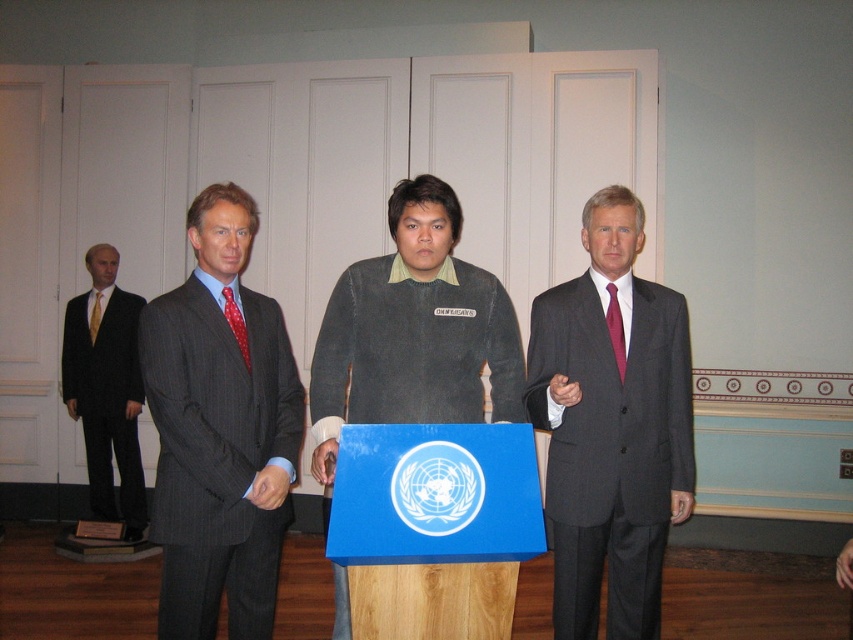
Does dark gray sweater at center appear on the right side of matte black suit at left?

Yes, dark gray sweater at center is to the right of matte black suit at left.

Is dark gray sweater at center further to the viewer compared to matte black suit at left?

No, it is not.

This screenshot has width=853, height=640. What are the coordinates of `dark gray sweater at center` in the screenshot? It's located at (415, 332).

Is point (622, 368) less distant than point (96, 314)?

Yes, point (622, 368) is in front of point (96, 314).

Which is above, maroon silk tie at right or yellow silk tie at left?

yellow silk tie at left is above.

What are the coordinates of `maroon silk tie at right` in the screenshot? It's located at (614, 330).

Is gray pinstripe suit at center below yellow silk tie at left?

Yes.

Which is behind, point (288, 483) or point (90, 308)?

Positioned behind is point (90, 308).

In order to click on gray pinstripe suit at center in this screenshot , I will do `click(219, 432)`.